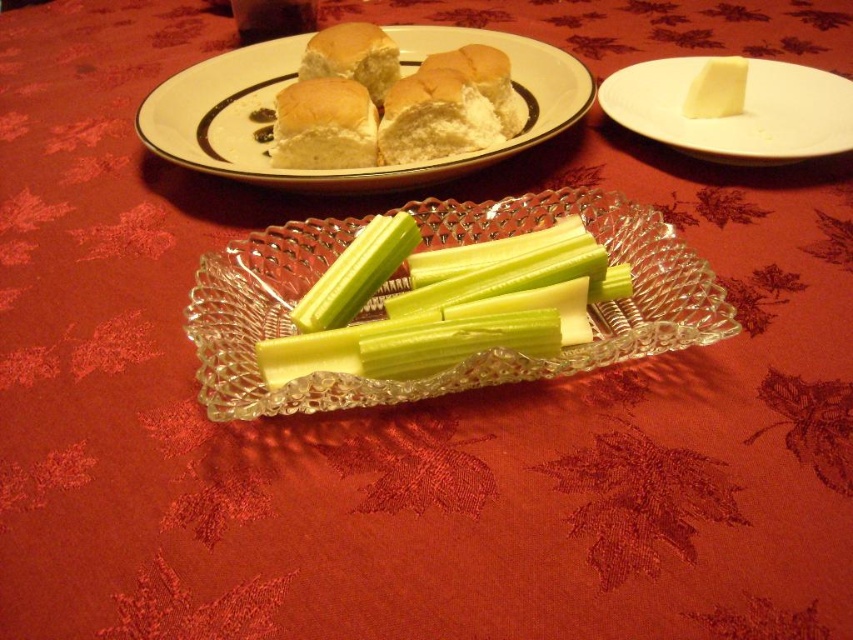
You are arranging a buffet table and need to place a decorative centerpiece between the green crisp celery at center and the golden brown bread rolls at upper center. Based on their positions, where should you place the centerpiece to ensure it is between them?

The green crisp celery at center is to the right of the golden brown bread rolls at upper center, so the centerpiece should be placed between them by positioning it to the right of the golden brown bread rolls at upper center and to the left of the green crisp celery at center.

You are a chef arranging a table for a dinner party. You have a green crisp celery at center and golden brown bread rolls at upper center on the table. You need to place a decorative centerpiece that requires at least 20 centimeters of space between them. Can the existing arrangement accommodate this requirement?

The green crisp celery at center and golden brown bread rolls at upper center are 21.57 centimeters apart from each other, which is more than the required 20 centimeters. Therefore, the existing arrangement can accommodate the decorative centerpiece requirement.